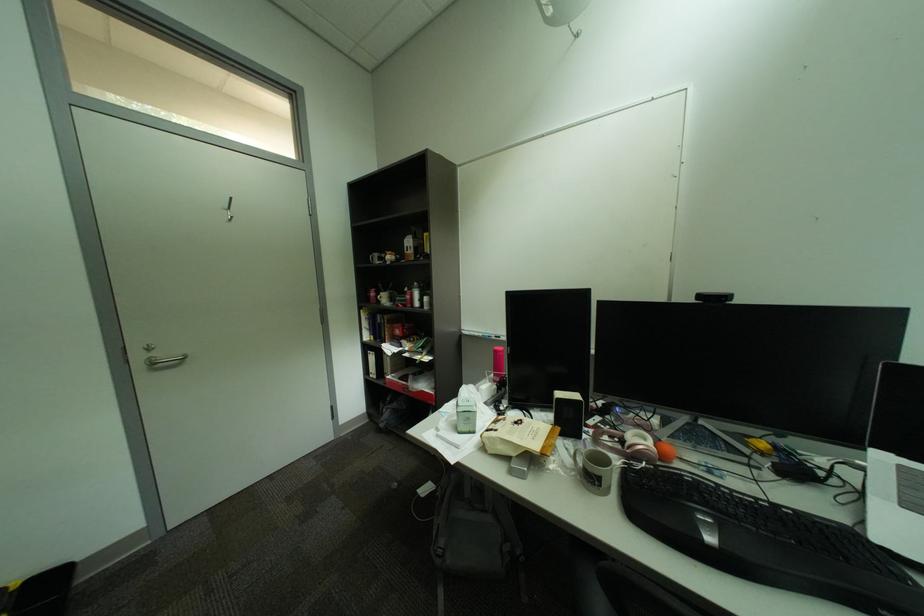
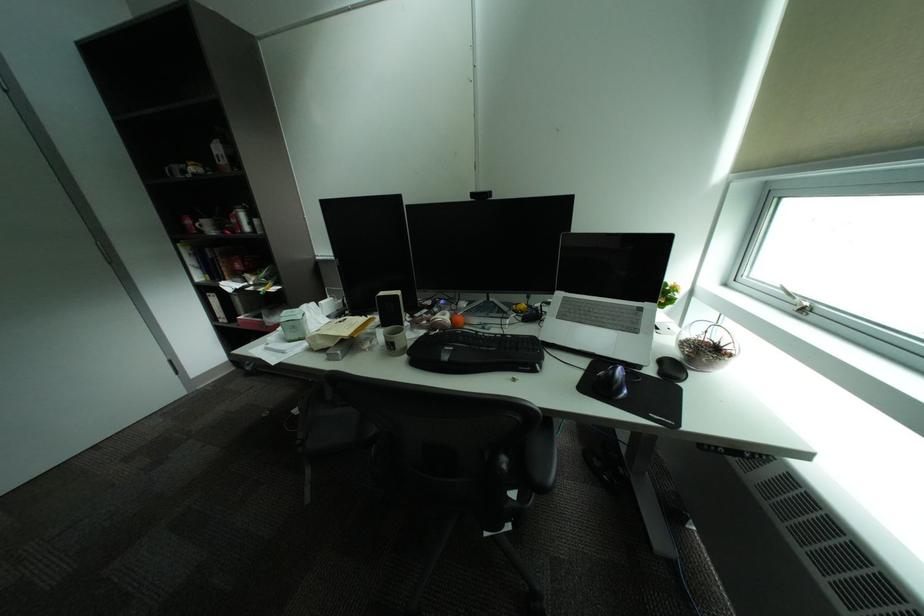
Find the pixel in the second image that matches [608,485] in the first image.

(403, 349)